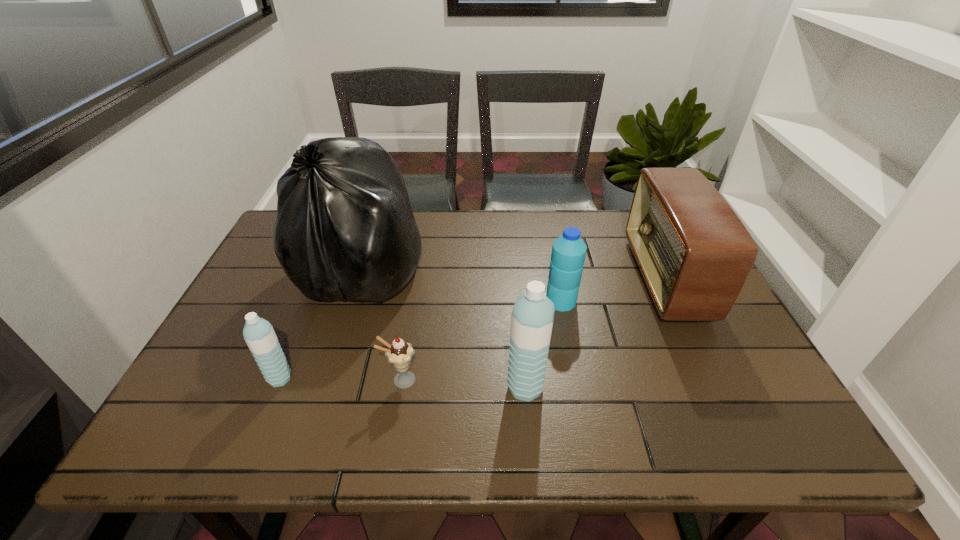
The height and width of the screenshot is (540, 960). Identify the location of free spot between the shortest object and the third object from right to left. (463, 383).

Find the location of a particular element. The width and height of the screenshot is (960, 540). vacant point located between the leftmost water bottle and the icecream is located at coordinates (340, 379).

Locate an element on the screen. free spot between the tallest water bottle and the shortest object is located at coordinates (463, 383).

The image size is (960, 540). I want to click on empty space that is in between the radio receiver and the tallest object, so click(x=515, y=272).

Point out which object is positioned as the fourth nearest to the second object from right to left. Please provide its 2D coordinates. Your answer should be formatted as a tuple, i.e. [(x, y)], where the tuple contains the x and y coordinates of a point satisfying the conditions above.

[(399, 353)]

The width and height of the screenshot is (960, 540). Find the location of `the fifth closest object relative to the tallest object`. the fifth closest object relative to the tallest object is located at coordinates (695, 254).

This screenshot has width=960, height=540. Identify the location of water bottle object that ranks as the closest to the tallest object. (258, 333).

Select which water bottle is the closest to the fourth object from left to right. Please provide its 2D coordinates. Your answer should be formatted as a tuple, i.e. [(x, y)], where the tuple contains the x and y coordinates of a point satisfying the conditions above.

[(568, 254)]

In order to click on free point that satisfies the following two spatial constraints: 1. on the front side of the icecream; 2. on the left side of the tallest object in this screenshot , I will do `click(327, 380)`.

Where is `free point that satisfies the following two spatial constraints: 1. on the front-facing side of the radio receiver; 2. on the front side of the leftmost water bottle`? The height and width of the screenshot is (540, 960). free point that satisfies the following two spatial constraints: 1. on the front-facing side of the radio receiver; 2. on the front side of the leftmost water bottle is located at coordinates (713, 378).